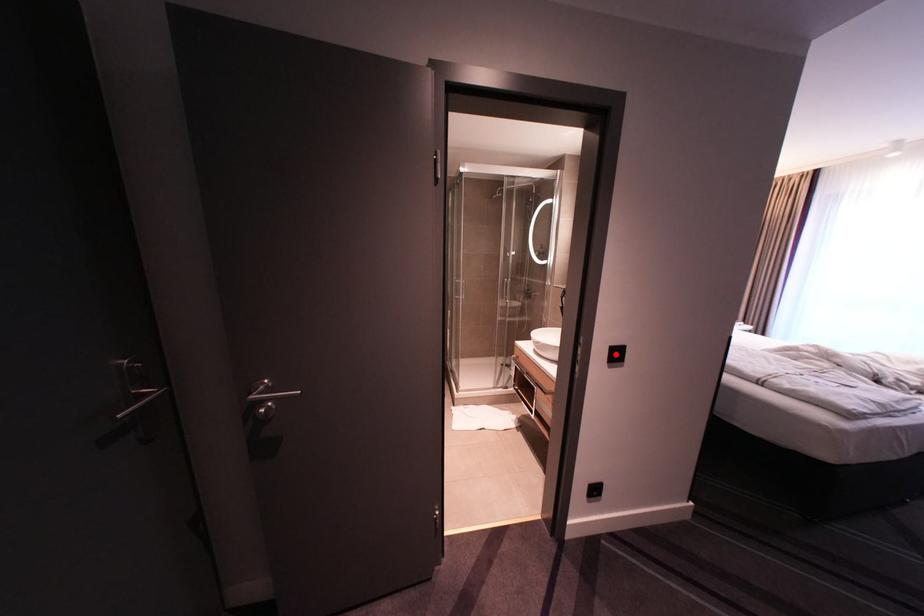
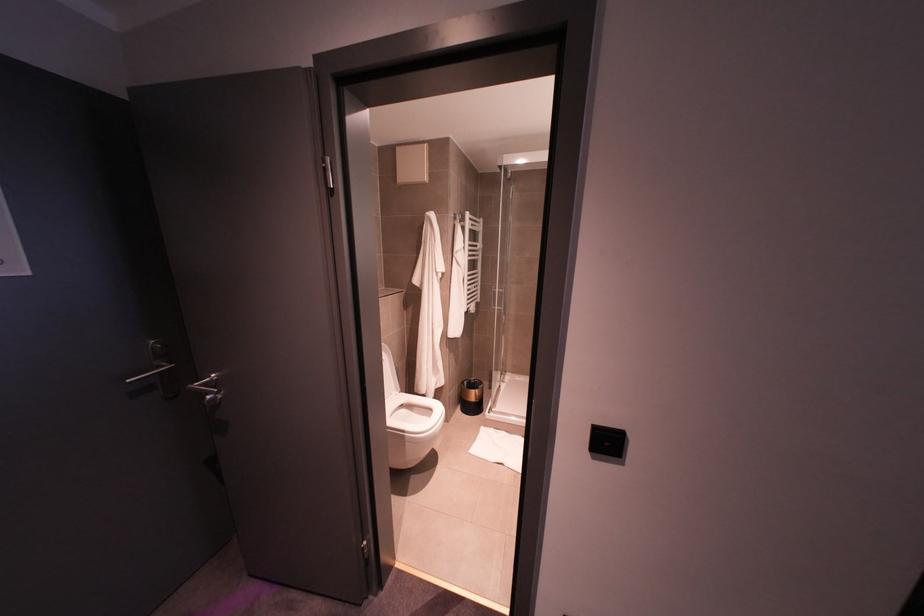
The point at the highlighted location is marked in the first image. Where is the corresponding point in the second image?

(606, 442)